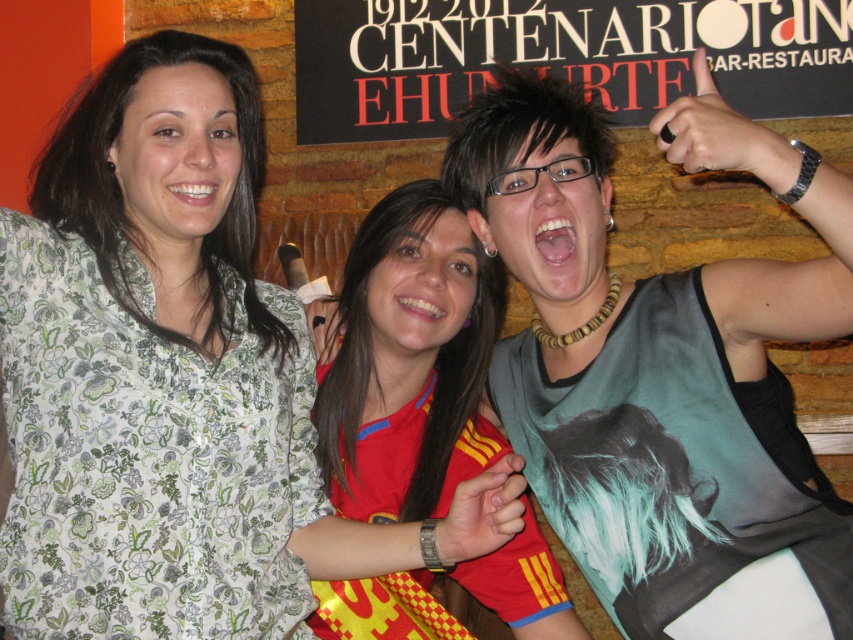
You are organizing a photo shoot and need to ensure that the green printed tank top at right is visible in the final image. Given that the black cardboard sign at upper center is in the background, where should you position the camera relative to the subjects?

To ensure the green printed tank top at right is visible, position the camera so that the green printed tank top at right is in front of the black cardboard sign at upper center, as it is already positioned in front of it according to the description.